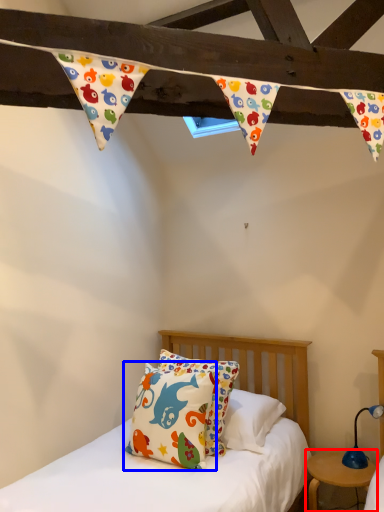
Question: Among these objects, which one is nearest to the camera, nightstand (highlighted by a red box) or pillow (highlighted by a blue box)?

Choices:
 (A) nightstand
 (B) pillow

Answer: (B)